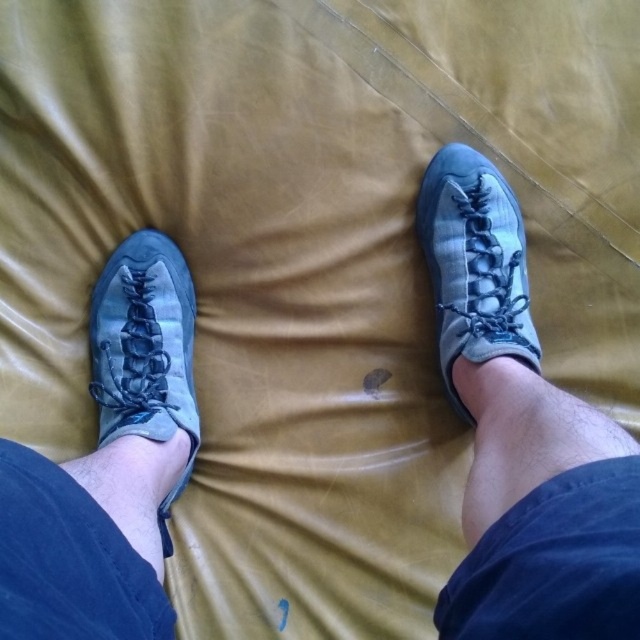
Looking at this image, you are a hiker planning to cross a narrow mountain path. You have two shoes to choose from, the matte blue fabric shoe at right and the matte gray shoe at left. Which shoe would you recommend for better stability on uneven terrain?

The matte gray shoe at left is thicker than the matte blue fabric shoe at right, providing better stability on uneven terrain.

You are standing in the scene and want to place a small object exactly at point (474, 262). What object will it land on?

The small object will land on the matte blue fabric shoe at right located at point (474, 262).